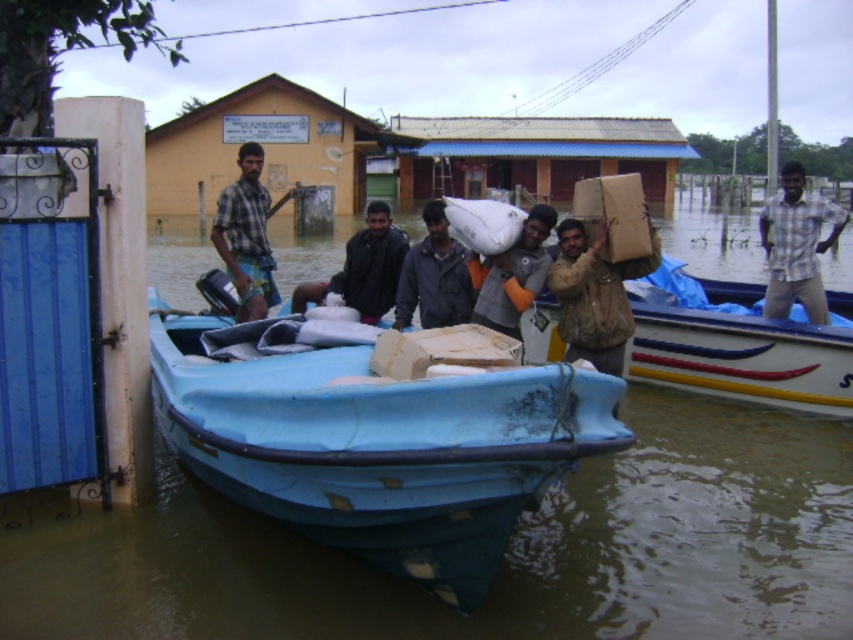
Question: Considering the real-world distances, which object is closest to the dark gray fabric jacket at center?

Choices:
 (A) checkered fabric shirt at center
 (B) blue matte boat at center
 (C) brown cardboard box at center

Answer: (B)

Question: Does blue plastic boat at center have a lesser width compared to blue matte boat at center?

Choices:
 (A) yes
 (B) no

Answer: (B)

Question: Is blue matte boat at center wider than dark gray jacket at center?

Choices:
 (A) no
 (B) yes

Answer: (B)

Question: Which of these objects is positioned closest to the plaid shirt at right?

Choices:
 (A) brown leather jacket at center
 (B) checkered fabric shirt at center
 (C) dark gray jacket at center

Answer: (A)

Question: Which point appears closest to the camera in this image?

Choices:
 (A) (380, 310)
 (B) (799, 209)
 (C) (607, 268)
 (D) (463, 280)

Answer: (C)

Question: Can you confirm if blue plastic boat at center is wider than brown cardboard box at center?

Choices:
 (A) no
 (B) yes

Answer: (B)